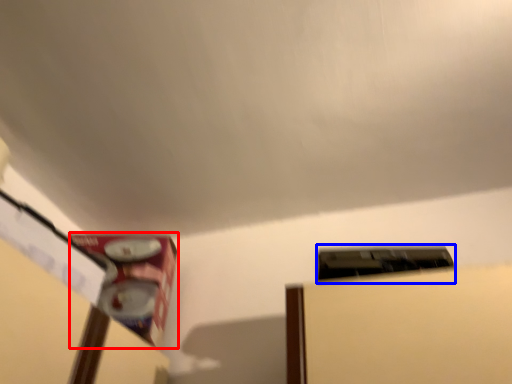
Question: Which of the following is the closest to the observer, water heater (highlighted by a red box) or water heater (highlighted by a blue box)?

Choices:
 (A) water heater
 (B) water heater

Answer: (B)